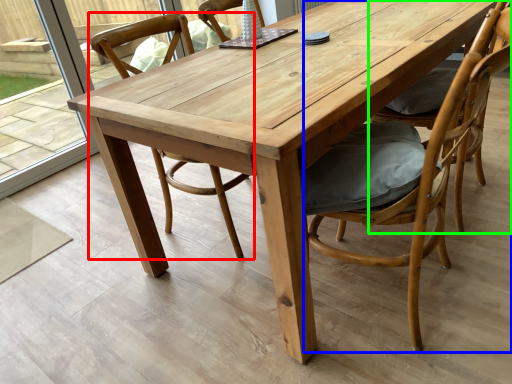
Question: Estimate the real-world distances between objects in this image. Which object is farther from chair (highlighted by a red box), chair (highlighted by a blue box) or chair (highlighted by a green box)?

Choices:
 (A) chair
 (B) chair

Answer: (B)